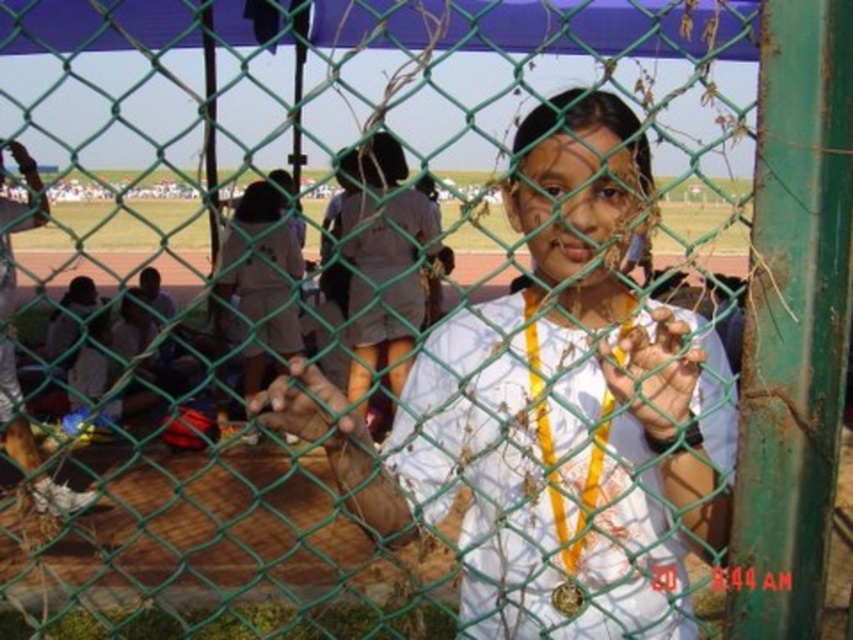
Based on the scene description, where exactly is the smooth skin hand at center located in the image?

The smooth skin hand at center is located at point (654, 372) in the image.

You are a photographer positioned at the origin point of the image coordinate system. You want to capture a photo of the white matte shirt at center. What are the coordinates where you should aim your camera?

The coordinates to aim your camera should be at point (564,412) to capture the white matte shirt at center.